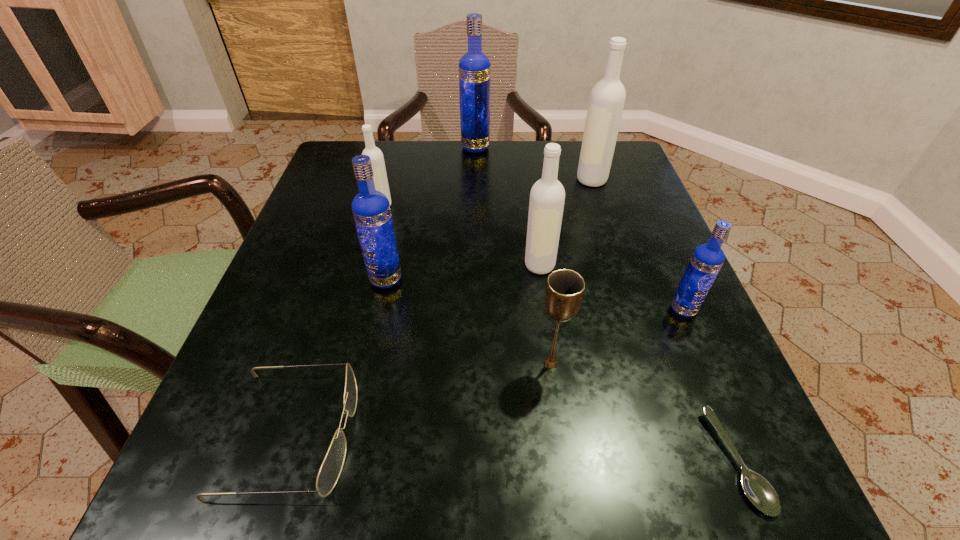
Image resolution: width=960 pixels, height=540 pixels. I want to click on the smallest white vodka, so click(x=377, y=160).

Identify the location of the second farthest white vodka. (377, 160).

The image size is (960, 540). I want to click on the seventh farthest object, so click(x=564, y=292).

At what (x,y) coordinates should I click in order to perform the action: click on beige spectacles. Please return your answer as a coordinate pair (x, y). Image resolution: width=960 pixels, height=540 pixels. Looking at the image, I should click on (331, 468).

Locate an element on the screen. The height and width of the screenshot is (540, 960). spectacles is located at coordinates (331, 468).

Identify the location of the shortest object. The image size is (960, 540). (759, 491).

Find the location of a particular element. The height and width of the screenshot is (540, 960). vacant space located 0.120m on the left of the sixth object from right to left is located at coordinates (414, 147).

You are a GUI agent. You are given a task and a screenshot of the screen. Output one action in this format:
    pyautogui.click(x=<x>, y=<y>)
    Task: Click on the free location located on the left of the biggest white vodka
    The image size is (960, 540).
    Given the screenshot: What is the action you would take?
    pyautogui.click(x=493, y=179)

The width and height of the screenshot is (960, 540). Find the location of `vacant space situated on the front of the fourth vodka from left to right`. vacant space situated on the front of the fourth vodka from left to right is located at coordinates (559, 402).

You are a GUI agent. You are given a task and a screenshot of the screen. Output one action in this format:
    pyautogui.click(x=<x>, y=<y>)
    Task: Click on the vacant space situated on the back of the leftmost blue vodka
    The height and width of the screenshot is (540, 960).
    Given the screenshot: What is the action you would take?
    pyautogui.click(x=412, y=158)